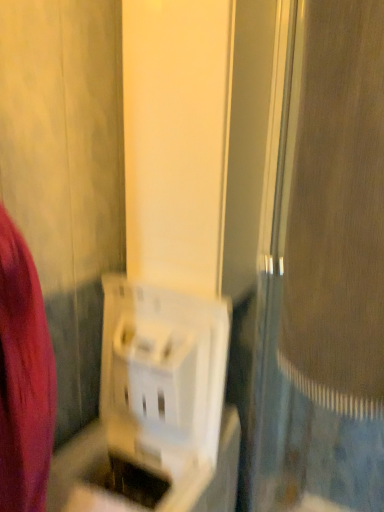
What do you see at coordinates (321, 266) in the screenshot?
I see `white plastic screen door at center` at bounding box center [321, 266].

Locate an element on the screen. white plastic screen door at center is located at coordinates pyautogui.click(x=321, y=266).

What is the approximate height of white plastic basket at center?

The height of white plastic basket at center is 38.09 inches.

What do you see at coordinates (155, 410) in the screenshot? Image resolution: width=384 pixels, height=512 pixels. I see `white plastic basket at center` at bounding box center [155, 410].

Where is `white plastic basket at center`? white plastic basket at center is located at coordinates (155, 410).

Locate an element on the screen. The image size is (384, 512). white plastic screen door at center is located at coordinates (321, 266).

Does white plastic basket at center appear on the right side of white plastic screen door at center?

Incorrect, white plastic basket at center is not on the right side of white plastic screen door at center.

Is white plastic basket at center further to camera compared to white plastic screen door at center?

Yes, white plastic basket at center is further from the viewer.

Does point (142, 315) appear closer or farther from the camera than point (284, 156)?

Point (142, 315) appears to be farther away from the viewer than point (284, 156).

From the image's perspective, is white plastic basket at center above white plastic screen door at center?

Actually, white plastic basket at center appears below white plastic screen door at center in the image.

From a real-world perspective, is white plastic basket at center physically below white plastic screen door at center?

Correct, in the physical world, white plastic basket at center is lower than white plastic screen door at center.

Can you confirm if white plastic basket at center is wider than white plastic screen door at center?

No.

Considering the sizes of objects white plastic basket at center and white plastic screen door at center in the image provided, who is shorter, white plastic basket at center or white plastic screen door at center?

white plastic basket at center.

Looking at the image, does white plastic basket at center seem bigger or smaller compared to white plastic screen door at center?

In the image, white plastic basket at center appears to be smaller than white plastic screen door at center.

Is white plastic basket at center spatially inside white plastic screen door at center, or outside of it?

white plastic basket at center lies outside white plastic screen door at center.

Looking at this image, is white plastic basket at center far from white plastic screen door at center?

They are positioned close to each other.

Is white plastic basket at center looking in the opposite direction of white plastic screen door at center?

That's not correct — white plastic basket at center is not looking away from white plastic screen door at center.

How many degrees apart are the facing directions of white plastic basket at center and white plastic screen door at center?

The facing directions of white plastic basket at center and white plastic screen door at center are 90 degrees apart.

Measure the distance from white plastic basket at center to white plastic screen door at center.

A distance of 14.31 inches exists between white plastic basket at center and white plastic screen door at center.

Locate an element on the screen. appliance below the white plastic screen door at center (from a real-world perspective) is located at coordinates (155, 410).

Would you say white plastic screen door at center is to the left or to the right of white plastic basket at center in the picture?

Clearly, white plastic screen door at center is on the right of white plastic basket at center in the image.

Is white plastic screen door at center positioned before white plastic basket at center?

Yes, white plastic screen door at center is closer to the camera.

Which point is more forward, [345,353] or [148,465]?

The point [345,353] is closer to the camera.

From the image's perspective, does white plastic screen door at center appear higher than white plastic basket at center?

Yes, from the image's perspective, white plastic screen door at center is over white plastic basket at center.

From a real-world perspective, does white plastic screen door at center stand above white plastic basket at center?

Indeed, from a real-world perspective, white plastic screen door at center stands above white plastic basket at center.

Considering the relative sizes of white plastic screen door at center and white plastic basket at center in the image provided, is white plastic screen door at center wider than white plastic basket at center?

Correct, the width of white plastic screen door at center exceeds that of white plastic basket at center.

Is white plastic screen door at center taller or shorter than white plastic basket at center?

In the image, white plastic screen door at center appears to be taller than white plastic basket at center.

Consider the image. Between white plastic screen door at center and white plastic basket at center, which one has larger size?

Bigger between the two is white plastic screen door at center.

Is white plastic screen door at center not inside white plastic basket at center?

white plastic screen door at center is positioned outside white plastic basket at center.

Is white plastic screen door at center next to white plastic basket at center and touching it?

No, white plastic screen door at center is not in contact with white plastic basket at center.

Is white plastic screen door at center oriented away from white plastic basket at center?

No, white plastic basket at center is not at the back of white plastic screen door at center.

How many degrees apart are the facing directions of white plastic screen door at center and white plastic basket at center?

There is a 90-degree angle between the facing directions of white plastic screen door at center and white plastic basket at center.

How distant is white plastic screen door at center from white plastic basket at center?

Answer: 14.31 inches.

Find the location of a particular element. screen door on the right of white plastic basket at center is located at coordinates (321, 266).

Where is `screen door on the right of white plastic basket at center`? screen door on the right of white plastic basket at center is located at coordinates (321, 266).

Find the location of a particular element. The width and height of the screenshot is (384, 512). screen door above the white plastic basket at center (from the image's perspective) is located at coordinates (321, 266).